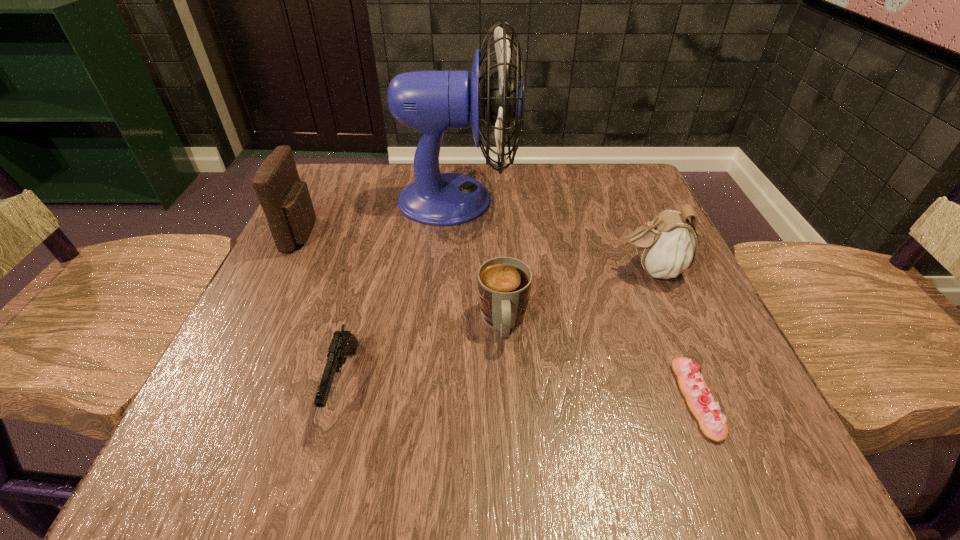
At what (x,y) coordinates should I click in order to perform the action: click on vacant space in between the eclair and the fan. Please return your answer as a coordinate pair (x, y). The width and height of the screenshot is (960, 540). Looking at the image, I should click on (577, 299).

I want to click on object that is the closest to the eclair, so click(x=667, y=246).

Identify which object is the fifth nearest to the left pouch. Please provide its 2D coordinates. Your answer should be formatted as a tuple, i.e. [(x, y)], where the tuple contains the x and y coordinates of a point satisfying the conditions above.

[(702, 404)]

Locate an element on the screen. The height and width of the screenshot is (540, 960). free location that satisfies the following two spatial constraints: 1. in front of the fan where the airflow is directed; 2. on the back side of the eclair is located at coordinates (444, 399).

Locate an element on the screen. vacant space that satisfies the following two spatial constraints: 1. with an open flap on the taller pouch; 2. on the right side of the eclair is located at coordinates (223, 399).

Find the location of a particular element. free region that satisfies the following two spatial constraints: 1. on the front-facing side of the shorter pouch; 2. on the side of the mug with the handle is located at coordinates (673, 323).

I want to click on vacant space that satisfies the following two spatial constraints: 1. in front of the tallest object where the airflow is directed; 2. on the left side of the eclair, so click(444, 399).

The width and height of the screenshot is (960, 540). Identify the location of free spot that satisfies the following two spatial constraints: 1. on the back side of the eclair; 2. in front of the fan where the airflow is directed. (616, 200).

Find the location of `free spot that satisfies the following two spatial constraints: 1. on the front-facing side of the right pouch; 2. at the end of the barrel of the gun`. free spot that satisfies the following two spatial constraints: 1. on the front-facing side of the right pouch; 2. at the end of the barrel of the gun is located at coordinates (698, 383).

Locate an element on the screen. vacant space that satisfies the following two spatial constraints: 1. in front of the fan where the airflow is directed; 2. at the end of the barrel of the gun is located at coordinates (444, 383).